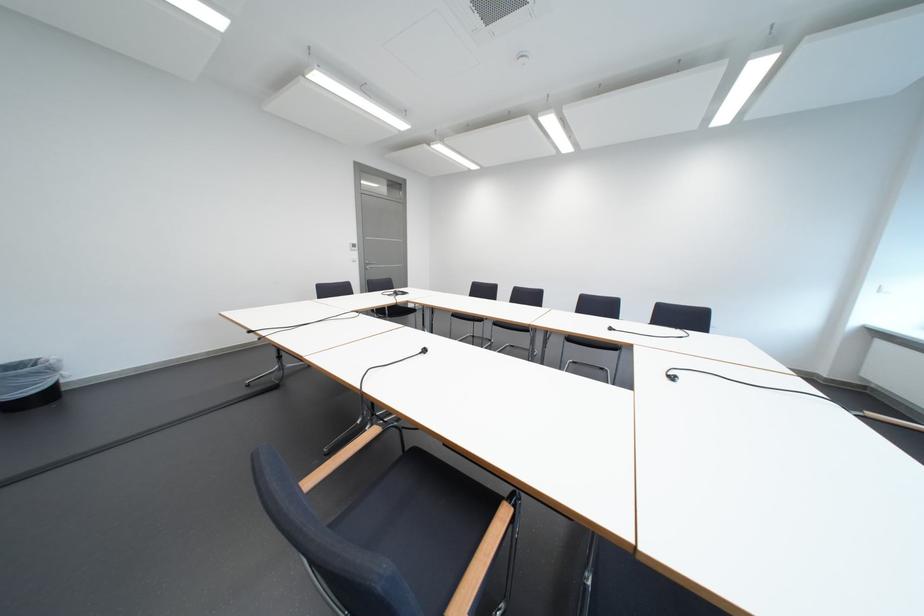
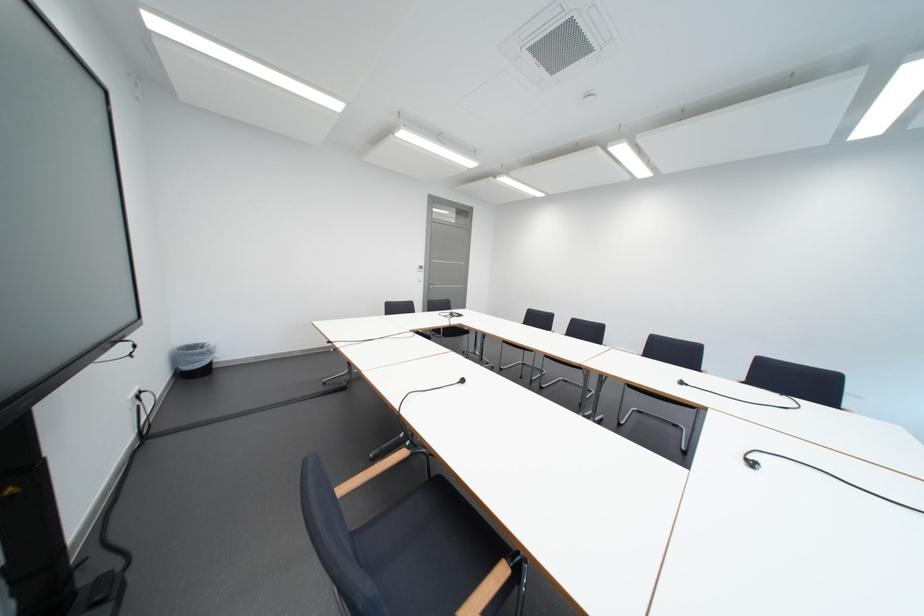
Question: The first image is from the beginning of the video and the second image is from the end. How did the camera likely rotate when shooting the video?

Choices:
 (A) Left
 (B) Right
 (C) Up
 (D) Down

Answer: (A)